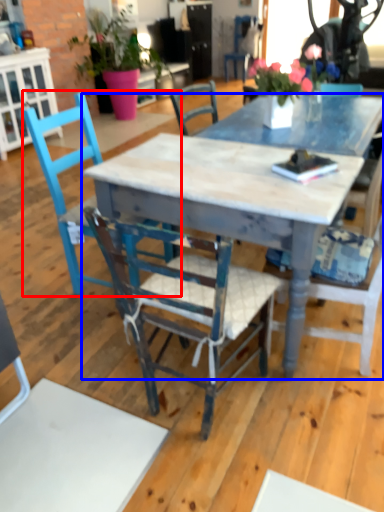
Question: Among these objects, which one is nearest to the camera, chair (highlighted by a red box) or desk (highlighted by a blue box)?

Choices:
 (A) chair
 (B) desk

Answer: (B)